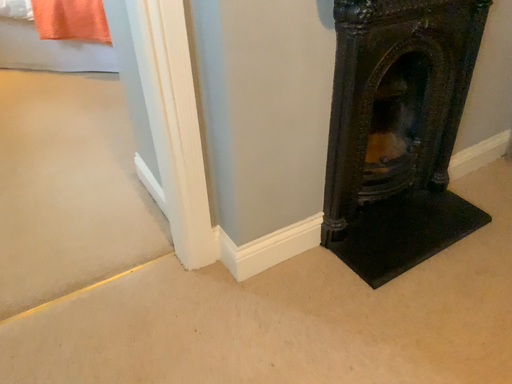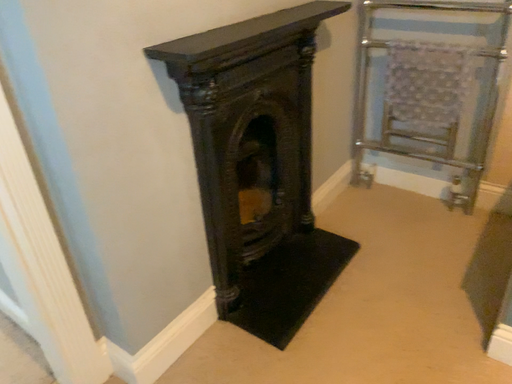
Question: How did the camera likely rotate when shooting the video?

Choices:
 (A) rotated left
 (B) rotated right

Answer: (B)